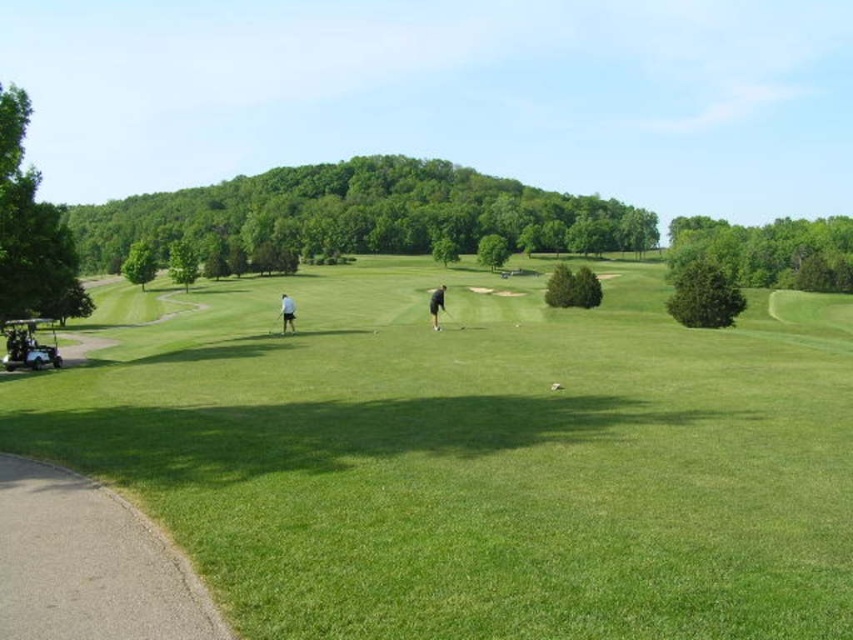
Measure the distance from green grassy field at center to black rubber golf club at center.

green grassy field at center and black rubber golf club at center are 19.24 meters apart.

Between green grassy field at center and black rubber golf club at center, which one is positioned lower?

green grassy field at center is lower down.

What do you see at coordinates (474, 456) in the screenshot? This screenshot has height=640, width=853. I see `green grassy field at center` at bounding box center [474, 456].

The image size is (853, 640). I want to click on green grassy field at center, so click(x=474, y=456).

Image resolution: width=853 pixels, height=640 pixels. What are the coordinates of `matte black golf cart at lower left` in the screenshot? It's located at (28, 346).

Can you confirm if matte black golf cart at lower left is wider than dark gray pants at center?

Indeed, matte black golf cart at lower left has a greater width compared to dark gray pants at center.

The image size is (853, 640). I want to click on matte black golf cart at lower left, so click(x=28, y=346).

Identify the location of matte black golf cart at lower left. (28, 346).

Is dark gray pants at center below metallic silver golf club at center?

Incorrect, dark gray pants at center is not positioned below metallic silver golf club at center.

At what (x,y) coordinates should I click in order to perform the action: click on dark gray pants at center. Please return your answer as a coordinate pair (x, y). This screenshot has width=853, height=640. Looking at the image, I should click on (436, 305).

Where is `dark gray pants at center`? Image resolution: width=853 pixels, height=640 pixels. dark gray pants at center is located at coordinates (436, 305).